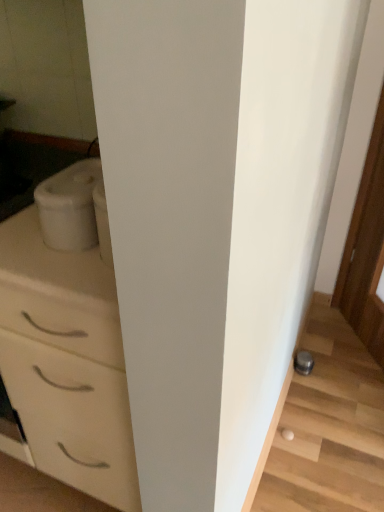
The image size is (384, 512). Find the location of `metallic gray stairwell at lower right`. metallic gray stairwell at lower right is located at coordinates (329, 426).

This screenshot has width=384, height=512. Identify the location of white matte container at left. (69, 207).

In terms of width, does white matte container at left look wider or thinner when compared to white glossy chest of drawers at left?

white matte container at left is thinner than white glossy chest of drawers at left.

Is white matte container at left shorter than white glossy chest of drawers at left?

Yes.

Is white matte container at left looking in the opposite direction of white glossy chest of drawers at left?

white matte container at left does not have its back to white glossy chest of drawers at left.

Is white matte container at left outside of white glossy chest of drawers at left?

Yes, white matte container at left is outside of white glossy chest of drawers at left.

Is metallic gray stairwell at lower right aimed at white matte container at left?

No, metallic gray stairwell at lower right does not turn towards white matte container at left.

Can you confirm if metallic gray stairwell at lower right is shorter than white matte container at left?

Yes, metallic gray stairwell at lower right is shorter than white matte container at left.

Considering the sizes of objects metallic gray stairwell at lower right and white matte container at left in the image provided, who is smaller, metallic gray stairwell at lower right or white matte container at left?

white matte container at left.

In terms of width, does metallic gray stairwell at lower right look wider or thinner when compared to white matte container at left?

Considering their sizes, metallic gray stairwell at lower right looks slimmer than white matte container at left.

Is white matte container at left positioned beyond the bounds of metallic gray stairwell at lower right?

That's correct, white matte container at left is outside of metallic gray stairwell at lower right.

Which object is more forward, white matte container at left or metallic gray stairwell at lower right?

white matte container at left is closer to the camera.

Considering the points (85, 230) and (340, 474), which point is in front, point (85, 230) or point (340, 474)?

The point (85, 230) is in front.

What's the angular difference between white matte container at left and metallic gray stairwell at lower right's facing directions?

They differ by 89.2 degrees in their facing directions.

From a real-world perspective, is metallic gray stairwell at lower right physically located above or below white glossy chest of drawers at left?

From a real-world perspective, metallic gray stairwell at lower right is physically below white glossy chest of drawers at left.

Is metallic gray stairwell at lower right oriented towards white glossy chest of drawers at left?

No, metallic gray stairwell at lower right is not facing towards white glossy chest of drawers at left.

What's the angular difference between metallic gray stairwell at lower right and white glossy chest of drawers at left's facing directions?

89.5 degrees.

Is metallic gray stairwell at lower right directly adjacent to white glossy chest of drawers at left?

metallic gray stairwell at lower right is not next to white glossy chest of drawers at left, and they're not touching.

From the image's perspective, is white glossy chest of drawers at left above white matte container at left?

No, from the image's perspective, white glossy chest of drawers at left is not above white matte container at left.

Considering the positions of objects white glossy chest of drawers at left and white matte container at left in the image provided, who is more to the left, white glossy chest of drawers at left or white matte container at left?

white glossy chest of drawers at left.

Identify the location of chest of drawers below the white matte container at left (from a real-world perspective). This screenshot has width=384, height=512. (66, 362).

Relative to metallic gray stairwell at lower right, is white glossy chest of drawers at left in front or behind?

white glossy chest of drawers at left is in front of metallic gray stairwell at lower right.

From the image's perspective, is white glossy chest of drawers at left under metallic gray stairwell at lower right?

No, from the image's perspective, white glossy chest of drawers at left is not below metallic gray stairwell at lower right.

Considering the sizes of white glossy chest of drawers at left and metallic gray stairwell at lower right in the image, is white glossy chest of drawers at left bigger or smaller than metallic gray stairwell at lower right?

white glossy chest of drawers at left is bigger than metallic gray stairwell at lower right.

Image resolution: width=384 pixels, height=512 pixels. In order to click on appliance that is behind the white glossy chest of drawers at left in this screenshot , I will do `click(69, 207)`.

Where is `appliance above the metallic gray stairwell at lower right (from the image's perspective)`? This screenshot has width=384, height=512. appliance above the metallic gray stairwell at lower right (from the image's perspective) is located at coordinates (69, 207).

Considering their positions, is metallic gray stairwell at lower right positioned closer to white glossy chest of drawers at left than white matte container at left?

Among the two, white matte container at left is located nearer to white glossy chest of drawers at left.

Which object lies nearer to the anchor point white matte container at left, white glossy chest of drawers at left or metallic gray stairwell at lower right?

white glossy chest of drawers at left.

Looking at the image, which one is located closer to metallic gray stairwell at lower right, white glossy chest of drawers at left or white matte container at left?

The object closer to metallic gray stairwell at lower right is white glossy chest of drawers at left.

From the image, which object appears to be farther from metallic gray stairwell at lower right, white matte container at left or white glossy chest of drawers at left?

white matte container at left is further to metallic gray stairwell at lower right.

From the image, which object appears to be farther from white matte container at left, metallic gray stairwell at lower right or white glossy chest of drawers at left?

metallic gray stairwell at lower right is further to white matte container at left.

Estimate the real-world distances between objects in this image. Which object is further from white glossy chest of drawers at left, white matte container at left or metallic gray stairwell at lower right?

Among the two, metallic gray stairwell at lower right is located further to white glossy chest of drawers at left.

Locate an element on the screen. Image resolution: width=384 pixels, height=512 pixels. appliance between white glossy chest of drawers at left and metallic gray stairwell at lower right is located at coordinates (69, 207).